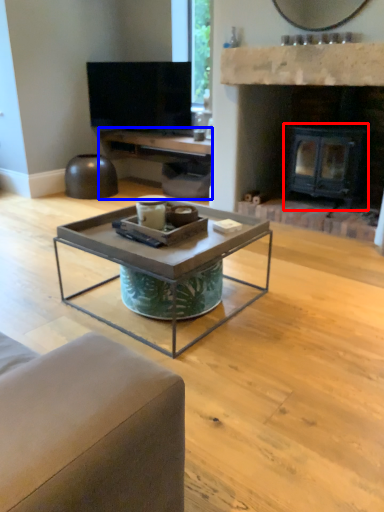
Question: Which of the following is the farthest to the observer, fireplace (highlighted by a red box) or entertainment center (highlighted by a blue box)?

Choices:
 (A) fireplace
 (B) entertainment center

Answer: (B)